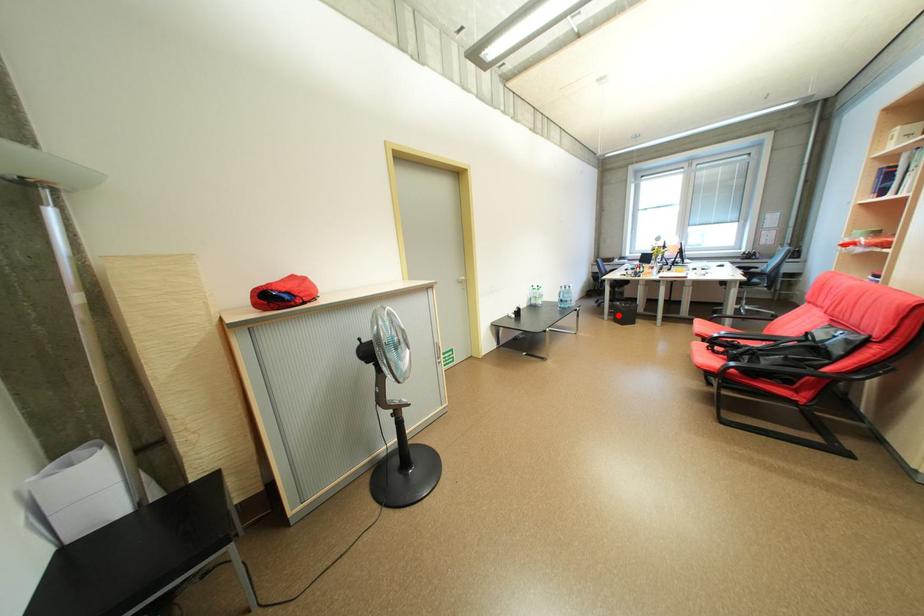
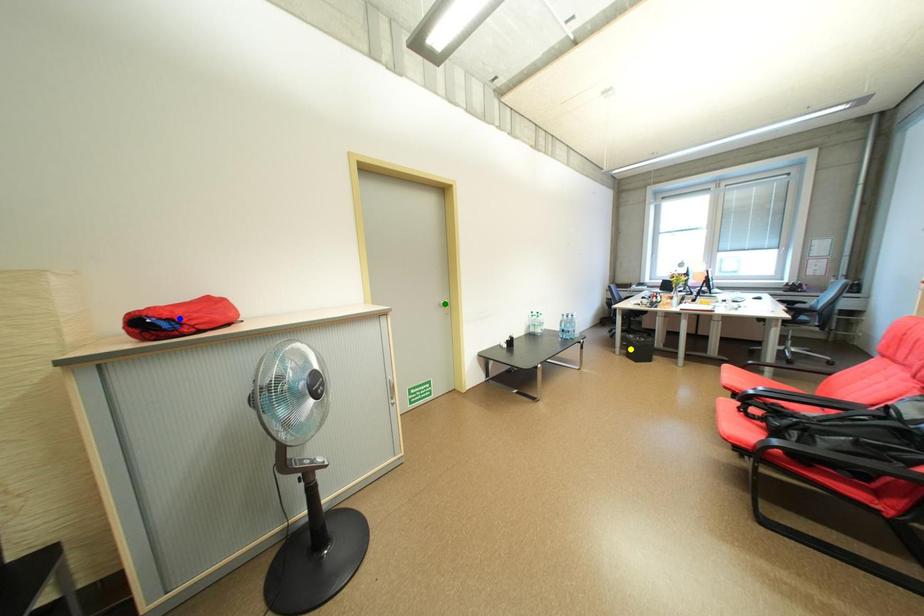
Question: I am providing you with two images of the same scene from different viewpoints. A red point is marked on the first image. You are given multiple points on the second image. In image 2, which mark is for the same physical point as the one in image 1?

Choices:
 (A) yellow point
 (B) blue point
 (C) green point

Answer: (A)